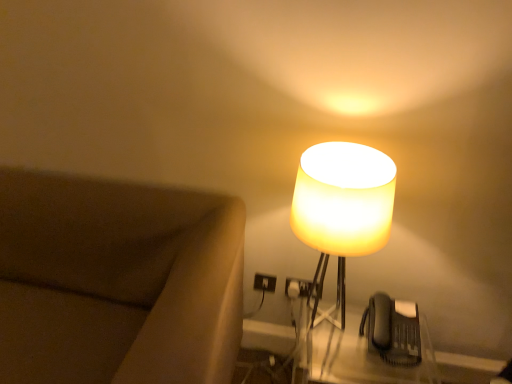
Question: From the image's perspective, would you say black plastic phone at lower right is shown under translucent yellow glass lampshade at right?

Choices:
 (A) no
 (B) yes

Answer: (B)

Question: Considering the relative sizes of black plastic phone at lower right and translucent yellow glass lampshade at right in the image provided, is black plastic phone at lower right thinner than translucent yellow glass lampshade at right?

Choices:
 (A) no
 (B) yes

Answer: (B)

Question: Considering the relative sizes of black plastic phone at lower right and translucent yellow glass lampshade at right in the image provided, is black plastic phone at lower right shorter than translucent yellow glass lampshade at right?

Choices:
 (A) yes
 (B) no

Answer: (A)

Question: Does black plastic phone at lower right appear on the left side of translucent yellow glass lampshade at right?

Choices:
 (A) no
 (B) yes

Answer: (A)

Question: Are black plastic phone at lower right and translucent yellow glass lampshade at right located far from each other?

Choices:
 (A) yes
 (B) no

Answer: (B)

Question: Which is correct: black plastic phone at lower right is inside translucent yellow glass lampshade at right, or outside of it?

Choices:
 (A) outside
 (B) inside

Answer: (A)

Question: From the image's perspective, is black plastic phone at lower right located above or below translucent yellow glass lampshade at right?

Choices:
 (A) below
 (B) above

Answer: (A)

Question: Does point (385, 334) appear closer or farther from the camera than point (384, 244)?

Choices:
 (A) farther
 (B) closer

Answer: (A)

Question: Is black plastic phone at lower right wider or thinner than translucent yellow glass lampshade at right?

Choices:
 (A) wide
 (B) thin

Answer: (B)

Question: Considering the positions of translucent yellow glass lampshade at right and brown fabric couch at left in the image, is translucent yellow glass lampshade at right bigger or smaller than brown fabric couch at left?

Choices:
 (A) small
 (B) big

Answer: (A)

Question: In terms of height, does translucent yellow glass lampshade at right look taller or shorter compared to brown fabric couch at left?

Choices:
 (A) short
 (B) tall

Answer: (A)

Question: Is translucent yellow glass lampshade at right inside the boundaries of brown fabric couch at left, or outside?

Choices:
 (A) inside
 (B) outside

Answer: (B)

Question: From the image's perspective, relative to brown fabric couch at left, is translucent yellow glass lampshade at right above or below?

Choices:
 (A) above
 (B) below

Answer: (A)

Question: From a real-world perspective, is black plastic phone at lower right above or below translucent plastic table at lower right?

Choices:
 (A) above
 (B) below

Answer: (A)

Question: From the image's perspective, relative to translucent plastic table at lower right, is black plastic phone at lower right above or below?

Choices:
 (A) below
 (B) above

Answer: (B)